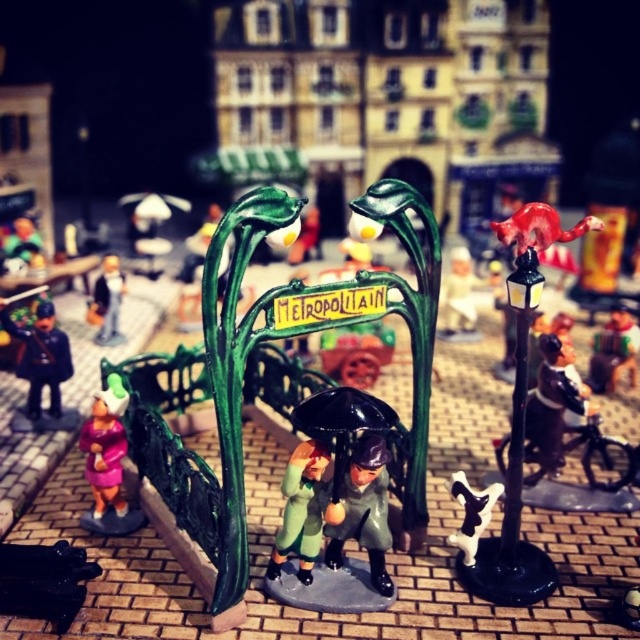
You are an artist setting up a display for an exhibition. You have two items to place on a shelf that can only support items up to 30 cm in height. The matte green coat at center and the white glossy cow at center are both part of the collection. Given their height relationship, which item is more likely to exceed the shelf height limit?

The matte green coat at center is taller than the white glossy cow at center, so the matte green coat at center is more likely to exceed the shelf height limit.

You are a tiny explorer standing at the base of the METROPOLITAIN archway. You want to reach the white glossy cow at center without stepping on the matte green umbrella at center. Can you safely walk around it? Explain your reasoning.

The matte green umbrella at center is 20.61 centimeters away from the white glossy cow at center. Since the distance is relatively large, you can safely walk around the matte green umbrella at center to reach the white glossy cow at center without stepping on it.

What are the coordinates of the shiny black umbrella at center?

The shiny black umbrella at center is located at coordinates point (337, 504).